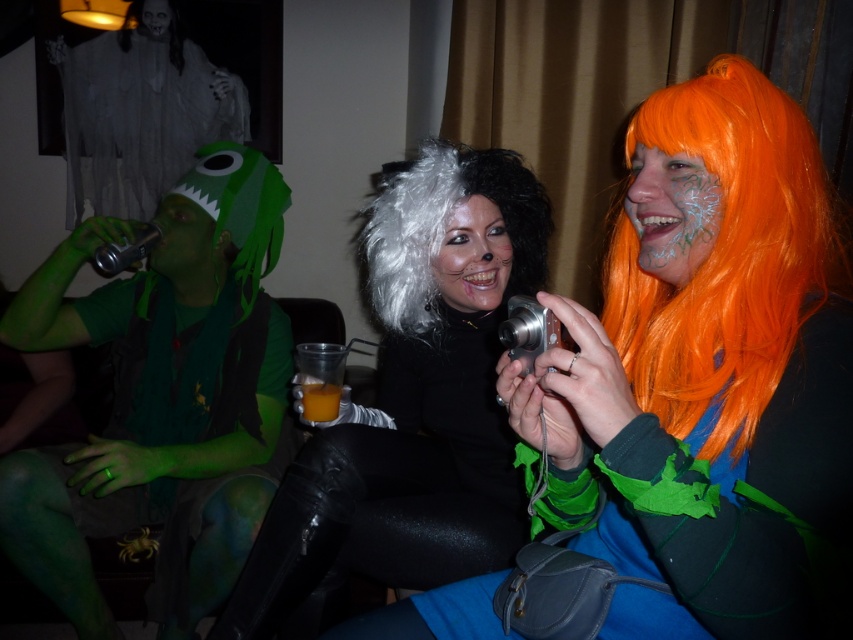
Between point (378, 451) and point (155, 35), which one is positioned behind?

The point (155, 35) is behind.

Locate an element on the screen. The width and height of the screenshot is (853, 640). black matte wig at center is located at coordinates (415, 396).

Does orange synthetic wig at right have a lesser height compared to orange wig at right?

No, orange synthetic wig at right is not shorter than orange wig at right.

Is orange synthetic wig at right behind orange wig at right?

No, it is in front of orange wig at right.

Locate an element on the screen. orange synthetic wig at right is located at coordinates [x=724, y=256].

Can you confirm if white fluffy wig at center is shorter than translucent plastic cup at center?

In fact, white fluffy wig at center may be taller than translucent plastic cup at center.

Who is taller, white fluffy wig at center or translucent plastic cup at center?

white fluffy wig at center is taller.

The image size is (853, 640). What do you see at coordinates (445, 227) in the screenshot? I see `white fluffy wig at center` at bounding box center [445, 227].

Find the location of a particular element. The height and width of the screenshot is (640, 853). white fluffy wig at center is located at coordinates (445, 227).